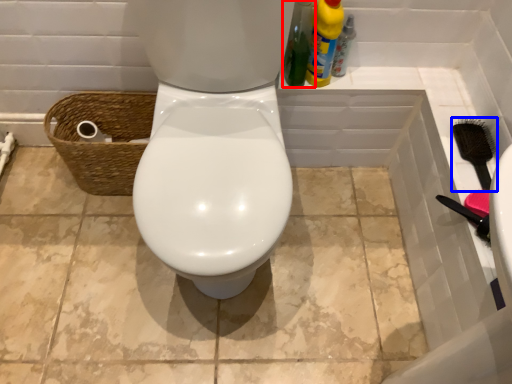
Question: Among these objects, which one is farthest to the camera, cleaning product (highlighted by a red box) or brush (highlighted by a blue box)?

Choices:
 (A) cleaning product
 (B) brush

Answer: (B)